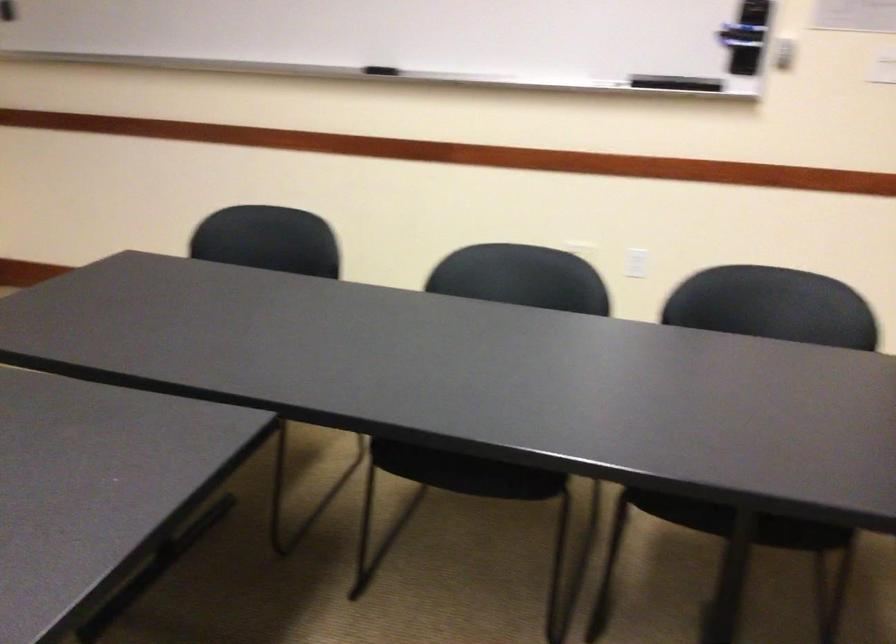
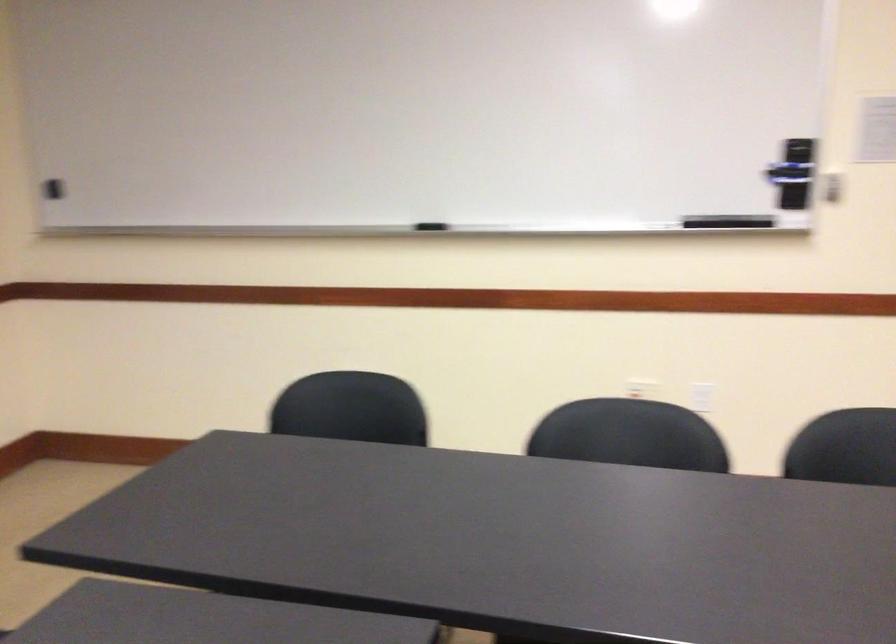
Question: In a continuous first-person perspective shot, in which direction is the camera moving?

Choices:
 (A) Left
 (B) Right
 (C) Forward
 (D) Backward

Answer: (A)